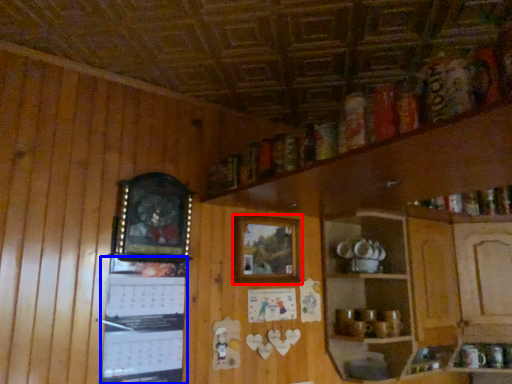
Question: Among these objects, which one is farthest to the camera, picture frame (highlighted by a red box) or bulletin board (highlighted by a blue box)?

Choices:
 (A) picture frame
 (B) bulletin board

Answer: (A)